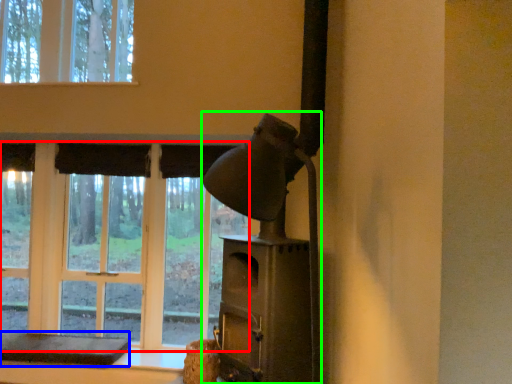
Question: Which object is the closest to the bay window (highlighted by a red box)? Choose among these: furniture (highlighted by a blue box) or fireplace (highlighted by a green box).

Choices:
 (A) furniture
 (B) fireplace

Answer: (A)